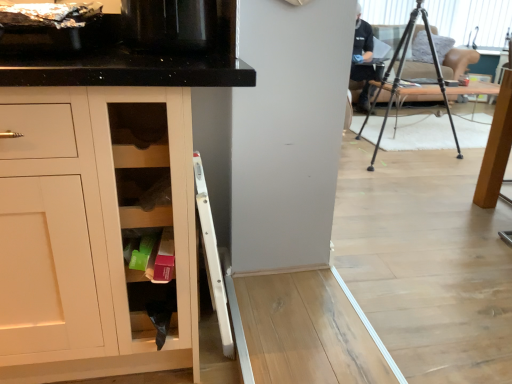
The width and height of the screenshot is (512, 384). I want to click on black glossy microwave at upper left, so click(170, 25).

What's the angular difference between light brown wooden table at right and black glossy microwave at upper left's facing directions?

The angle between the facing direction of light brown wooden table at right and the facing direction of black glossy microwave at upper left is 4.96 degrees.

From a real-world perspective, who is located higher, light brown wooden table at right or black glossy microwave at upper left?

In real-world perspective, black glossy microwave at upper left is above.

Looking at this image, is light brown wooden table at right positioned beyond the bounds of black glossy microwave at upper left?

Yes.

In the scene shown: Is wooden shelves at lower center oriented towards light brown wooden table at right?

No, wooden shelves at lower center does not turn towards light brown wooden table at right.

From a real-world perspective, between wooden shelves at lower center and light brown wooden table at right, who is vertically lower?

In real-world perspective, light brown wooden table at right is lower.

Considering the relative sizes of wooden shelves at lower center and light brown wooden table at right in the image provided, is wooden shelves at lower center shorter than light brown wooden table at right?

Indeed, wooden shelves at lower center has a lesser height compared to light brown wooden table at right.

Is wooden shelves at lower center positioned far away from light brown wooden table at right?

wooden shelves at lower center is far away from light brown wooden table at right.

Between light brown wooden table at right and wooden shelves at lower center, which one has less height?

wooden shelves at lower center is shorter.

Is light brown wooden table at right at the left side of wooden shelves at lower center?

No.

Between light brown wooden table at right and wooden shelves at lower center, which one has smaller size?

wooden shelves at lower center.

Is point (494, 131) closer to camera compared to point (145, 210)?

No, it is behind (145, 210).

From a real-world perspective, is black glossy microwave at upper left above or below wooden shelves at lower center?

black glossy microwave at upper left is situated higher than wooden shelves at lower center in the real world.

Considering the relative sizes of black glossy microwave at upper left and wooden shelves at lower center in the image provided, is black glossy microwave at upper left taller than wooden shelves at lower center?

Correct, black glossy microwave at upper left is much taller as wooden shelves at lower center.

Can you confirm if black glossy microwave at upper left is thinner than wooden shelves at lower center?

In fact, black glossy microwave at upper left might be wider than wooden shelves at lower center.

Does black glossy microwave at upper left have a greater height compared to light brown wooden table at right?

In fact, black glossy microwave at upper left may be shorter than light brown wooden table at right.

Is black glossy microwave at upper left positioned with its back to light brown wooden table at right?

No, black glossy microwave at upper left is not facing away from light brown wooden table at right.

Can we say black glossy microwave at upper left lies outside light brown wooden table at right?

That's correct, black glossy microwave at upper left is outside of light brown wooden table at right.

Between wooden shelves at lower center and black glossy microwave at upper left, which one has smaller size?

wooden shelves at lower center.

From a real-world perspective, who is located lower, wooden shelves at lower center or black glossy microwave at upper left?

From a 3D spatial view, wooden shelves at lower center is below.

Can you confirm if wooden shelves at lower center is thinner than black glossy microwave at upper left?

Yes.

Is wooden shelves at lower center located outside black glossy microwave at upper left?

Indeed, wooden shelves at lower center is completely outside black glossy microwave at upper left.

Locate an element on the screen. appliance on the left of light brown wooden table at right is located at coordinates (170, 25).

Where is `shelf in front of the light brown wooden table at right`? shelf in front of the light brown wooden table at right is located at coordinates (144, 197).

Looking at the image, which one is located further to wooden shelves at lower center, light brown wooden table at right or black glossy microwave at upper left?

light brown wooden table at right lies further to wooden shelves at lower center than the other object.

Estimate the real-world distances between objects in this image. Which object is closer to light brown wooden table at right, wooden shelves at lower center or black glossy microwave at upper left?

black glossy microwave at upper left.

From the image, which object appears to be nearer to black glossy microwave at upper left, light brown wooden table at right or wooden shelves at lower center?

wooden shelves at lower center lies closer to black glossy microwave at upper left than the other object.

Based on their spatial positions, is black glossy microwave at upper left or wooden shelves at lower center further from light brown wooden table at right?

Among the two, wooden shelves at lower center is located further to light brown wooden table at right.

From the image, which object appears to be nearer to wooden shelves at lower center, black glossy microwave at upper left or light brown wooden table at right?

black glossy microwave at upper left is closer to wooden shelves at lower center.

Based on their spatial positions, is wooden shelves at lower center or light brown wooden table at right closer to black glossy microwave at upper left?

wooden shelves at lower center lies closer to black glossy microwave at upper left than the other object.

The image size is (512, 384). I want to click on appliance between wooden shelves at lower center and light brown wooden table at right in the horizontal direction, so click(170, 25).